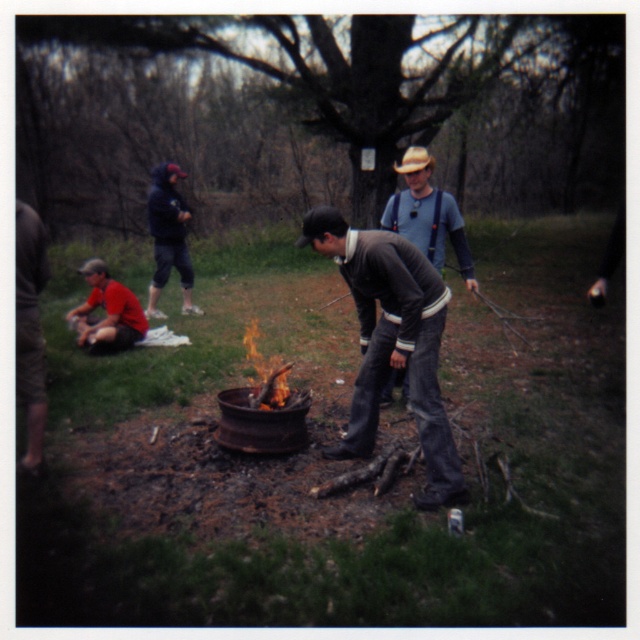
Question: Which point is farther to the camera?

Choices:
 (A) (198, 308)
 (B) (392, 216)

Answer: (A)

Question: Which point is closer to the camera?

Choices:
 (A) dark blue hoodie at upper left
 (B) dark gray jeans at center

Answer: (B)

Question: In this image, where is dark gray jeans at center located relative to matte blue shirt at center?

Choices:
 (A) above
 (B) below

Answer: (B)

Question: Which point is closer to the camera?

Choices:
 (A) (184, 248)
 (B) (410, 163)
 (C) (397, 285)

Answer: (C)

Question: Does dark gray jeans at center appear on the right side of matte blue shirt at center?

Choices:
 (A) no
 (B) yes

Answer: (A)

Question: Does dark gray jeans at center have a greater width compared to dark blue hoodie at upper left?

Choices:
 (A) no
 (B) yes

Answer: (B)